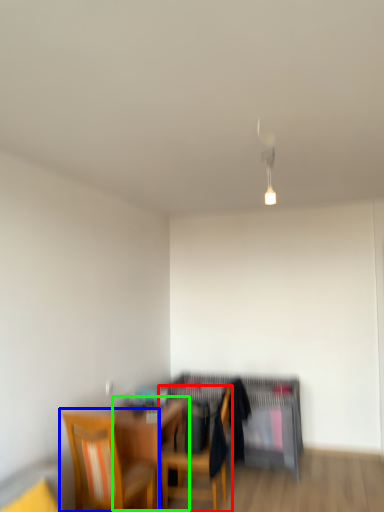
Question: Considering the real-world distances, which object is closest to chair (highlighted by a red box)? chair (highlighted by a blue box) or table (highlighted by a green box).

Choices:
 (A) chair
 (B) table

Answer: (B)